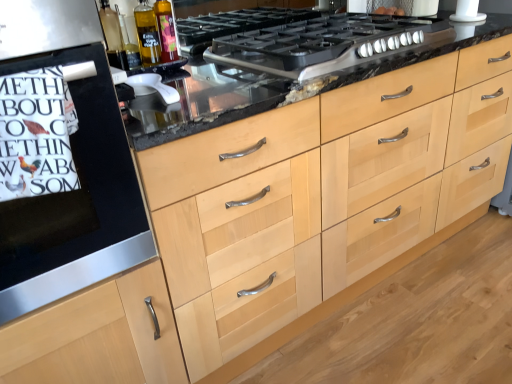
This screenshot has width=512, height=384. In order to click on unoccupied region to the right of translucent glass bottle at upper left, the second bottle in the left-to-right sequence in this screenshot , I will do `click(219, 66)`.